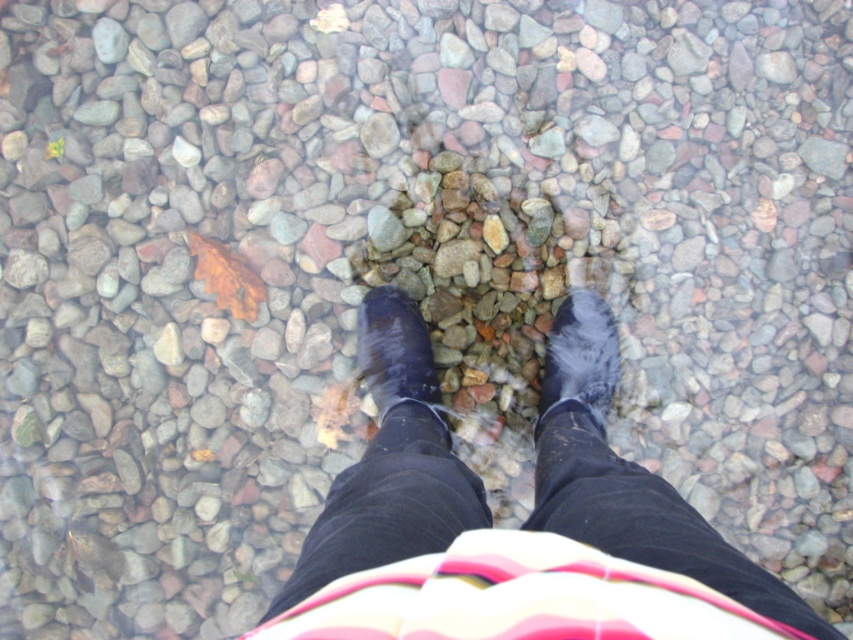
You are looking down at the pebbles and see two points marked on them. Which point is closer to you, point (369, 298) or point (413, 387)?

Point (369, 298) is closer to you than point (413, 387).

You are looking down at the pebbles and notice two points marked on the image. Which point is closer to your eyes? The points are labeled as point 1 at coordinates point (566, 353) and point 2 at coordinates point (407, 324).

Point 1 at coordinates point (566, 353) is closer to your eyes because it is further to the viewer than point 2 at coordinates point (407, 324).

You are a photographer trying to capture the reflection of the wet rubber boots at center and the shiny black boot at center on the pebbles. Which boot will have a more prominent reflection?

The wet rubber boots at center is taller than the shiny black boot at center, so the taller boot will cast a larger reflection on the pebbles.